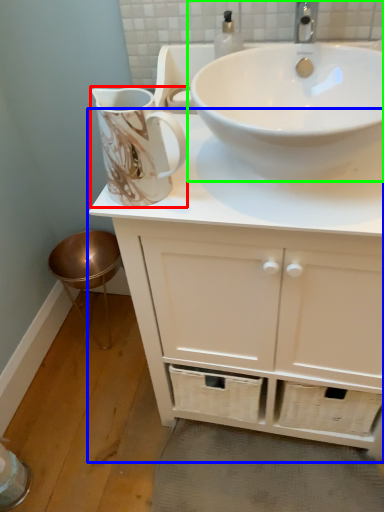
Question: Estimate the real-world distances between objects in this image. Which object is farther from jug (highlighted by a red box), bathroom cabinet (highlighted by a blue box) or sink (highlighted by a green box)?

Choices:
 (A) bathroom cabinet
 (B) sink

Answer: (A)